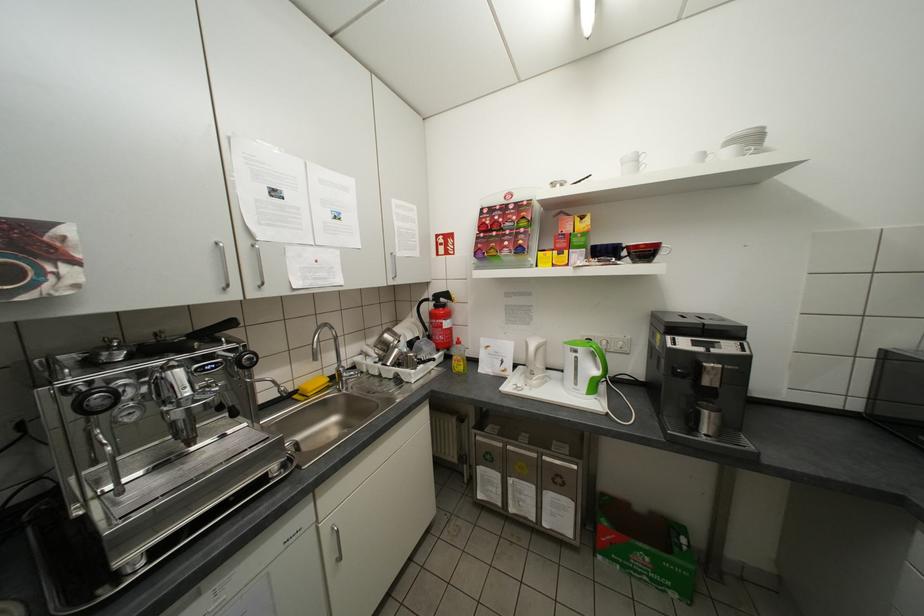
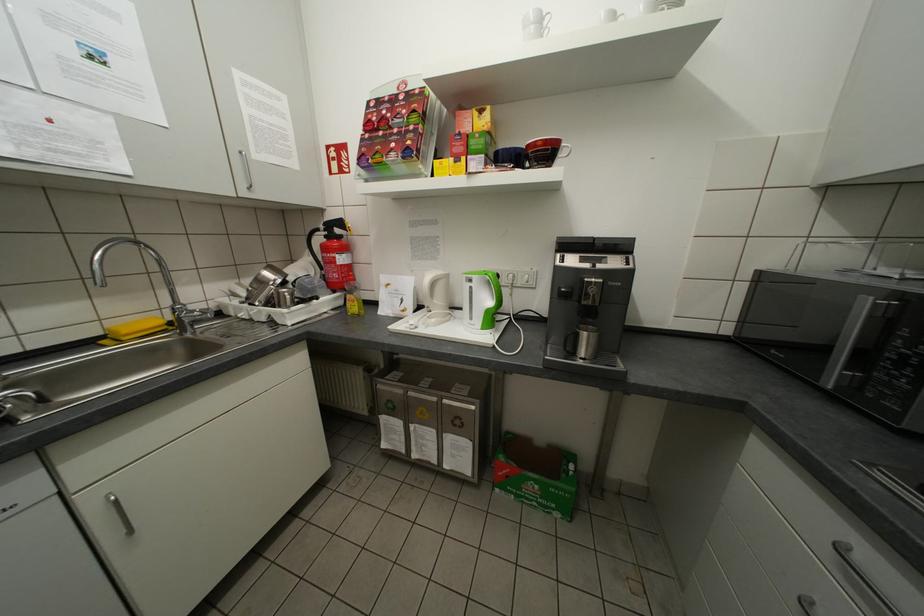
Where in the second image is the point corresponding to the point at 681,568 from the first image?

(565, 492)